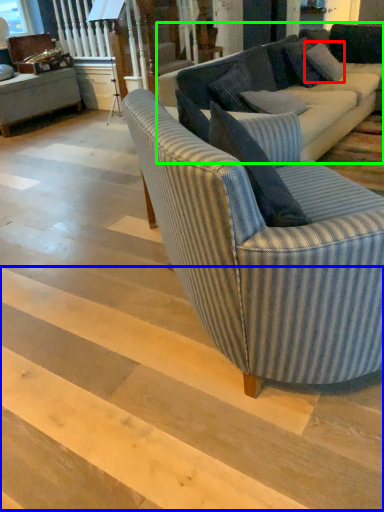
Question: Which is nearer to the pillow (highlighted by a red box)? stairwell (highlighted by a blue box) or studio couch (highlighted by a green box).

Choices:
 (A) stairwell
 (B) studio couch

Answer: (B)